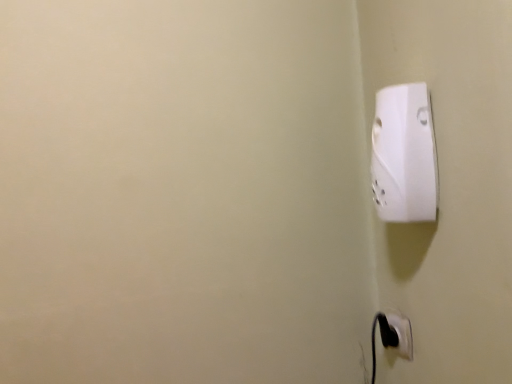
Question: Could you tell me if black plastic power plug at lower right, the 1th power plugs and sockets in the bottom-to-top sequence, is facing white plastic power plug at upper right, arranged as the second power plugs and sockets when viewed from the back?

Choices:
 (A) no
 (B) yes

Answer: (A)

Question: Is black plastic power plug at lower right, the second power plugs and sockets when ordered from top to bottom, facing away from white plastic power plug at upper right, marked as the second power plugs and sockets in a bottom-to-top arrangement?

Choices:
 (A) yes
 (B) no

Answer: (B)

Question: From a real-world perspective, is black plastic power plug at lower right, the first power plugs and sockets in the back-to-front sequence, on top of white plastic power plug at upper right, the first power plugs and sockets when ordered from front to back?

Choices:
 (A) yes
 (B) no

Answer: (B)

Question: Does black plastic power plug at lower right, the first power plugs and sockets in the back-to-front sequence, have a smaller size compared to white plastic power plug at upper right, the first power plugs and sockets when ordered from front to back?

Choices:
 (A) yes
 (B) no

Answer: (A)

Question: Are black plastic power plug at lower right, the second power plugs and sockets when ordered from top to bottom, and white plastic power plug at upper right, the first power plugs and sockets positioned from the top, far apart?

Choices:
 (A) yes
 (B) no

Answer: (B)

Question: Considering the relative positions of black plastic power plug at lower right, the second power plugs and sockets when ordered from top to bottom, and white plastic power plug at upper right, marked as the second power plugs and sockets in a bottom-to-top arrangement, in the image provided, is black plastic power plug at lower right, the second power plugs and sockets when ordered from top to bottom, to the right of white plastic power plug at upper right, marked as the second power plugs and sockets in a bottom-to-top arrangement, from the viewer's perspective?

Choices:
 (A) yes
 (B) no

Answer: (A)

Question: Can you confirm if white plastic power plug at upper right, arranged as the second power plugs and sockets when viewed from the back, is thinner than black plastic power plug at lower right, marked as the second power plugs and sockets in a front-to-back arrangement?

Choices:
 (A) no
 (B) yes

Answer: (A)

Question: Is white plastic power plug at upper right, arranged as the second power plugs and sockets when viewed from the back, shorter than black plastic power plug at lower right, marked as the second power plugs and sockets in a front-to-back arrangement?

Choices:
 (A) no
 (B) yes

Answer: (A)

Question: Is white plastic power plug at upper right, the first power plugs and sockets when ordered from front to back, positioned far away from black plastic power plug at lower right, the first power plugs and sockets in the back-to-front sequence?

Choices:
 (A) no
 (B) yes

Answer: (A)

Question: Does white plastic power plug at upper right, the first power plugs and sockets positioned from the top, appear on the right side of black plastic power plug at lower right, the second power plugs and sockets when ordered from top to bottom?

Choices:
 (A) no
 (B) yes

Answer: (A)

Question: From the image's perspective, is white plastic power plug at upper right, arranged as the second power plugs and sockets when viewed from the back, below black plastic power plug at lower right, the first power plugs and sockets in the back-to-front sequence?

Choices:
 (A) no
 (B) yes

Answer: (A)

Question: Is black plastic power plug at lower right, the second power plugs and sockets when ordered from top to bottom, surrounded by white plastic power plug at upper right, marked as the second power plugs and sockets in a bottom-to-top arrangement?

Choices:
 (A) yes
 (B) no

Answer: (B)

Question: From the image's perspective, is white plastic power plug at upper right, the first power plugs and sockets positioned from the top, above or below black plastic power plug at lower right, the 1th power plugs and sockets in the bottom-to-top sequence?

Choices:
 (A) below
 (B) above

Answer: (B)